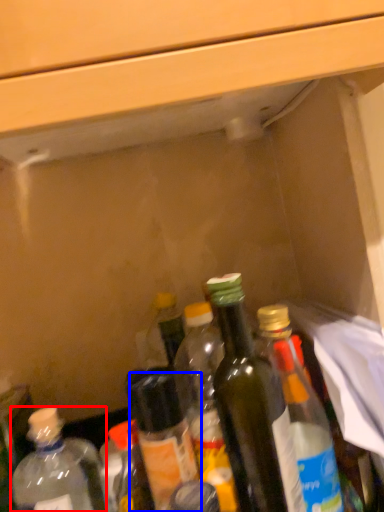
Question: Which of the following is the closest to the observer, bottle (highlighted by a red box) or bottle (highlighted by a blue box)?

Choices:
 (A) bottle
 (B) bottle

Answer: (A)